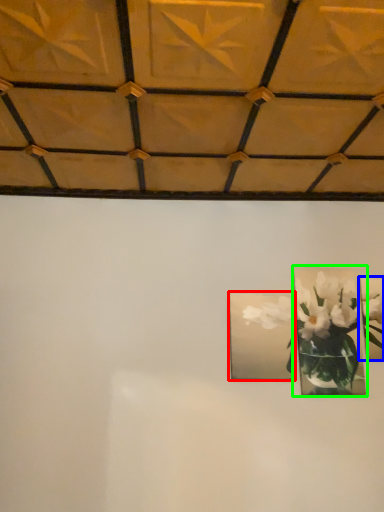
Question: Estimate the real-world distances between objects in this image. Which object is closer to picture frame (highlighted by a red box), picture frame (highlighted by a blue box) or picture frame (highlighted by a green box)?

Choices:
 (A) picture frame
 (B) picture frame

Answer: (B)